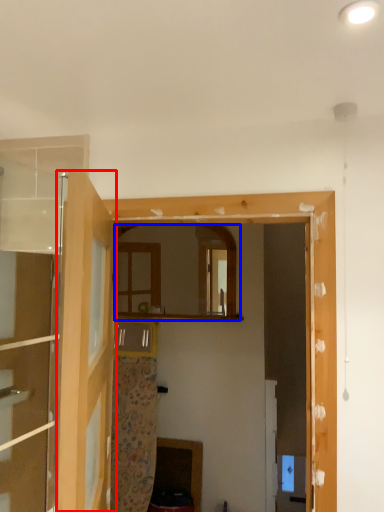
Question: Among these objects, which one is farthest to the camera, door (highlighted by a red box) or mirror (highlighted by a blue box)?

Choices:
 (A) door
 (B) mirror

Answer: (B)